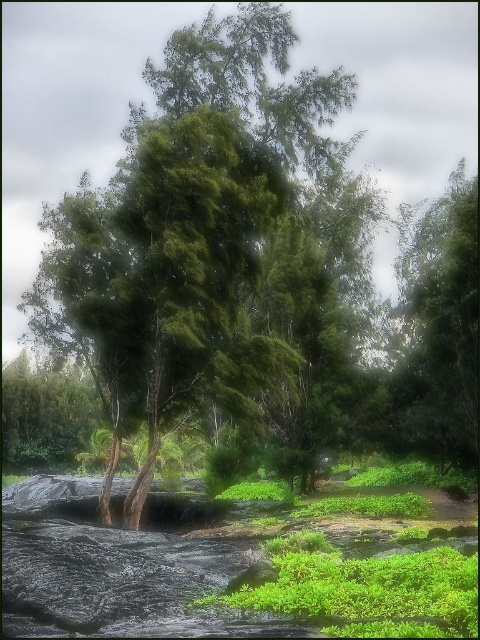
Question: Does green mossy rock at lower center appear over green leafy tree at right?

Choices:
 (A) no
 (B) yes

Answer: (A)

Question: Among these objects, which one is farthest from the camera?

Choices:
 (A) green leafy tree at center
 (B) green mossy rock at lower center
 (C) green leafy tree at right

Answer: (C)

Question: Estimate the real-world distances between objects in this image. Which object is farther from the green leafy tree at center?

Choices:
 (A) green mossy rock at lower center
 (B) green leafy tree at right

Answer: (A)

Question: Can you confirm if green leafy tree at center is smaller than green mossy rock at lower center?

Choices:
 (A) no
 (B) yes

Answer: (A)

Question: Can you confirm if green leafy tree at center is positioned to the right of green leafy tree at right?

Choices:
 (A) no
 (B) yes

Answer: (A)

Question: Which of the following is the farthest from the observer?

Choices:
 (A) (325, 212)
 (B) (454, 292)
 (C) (435, 548)

Answer: (A)